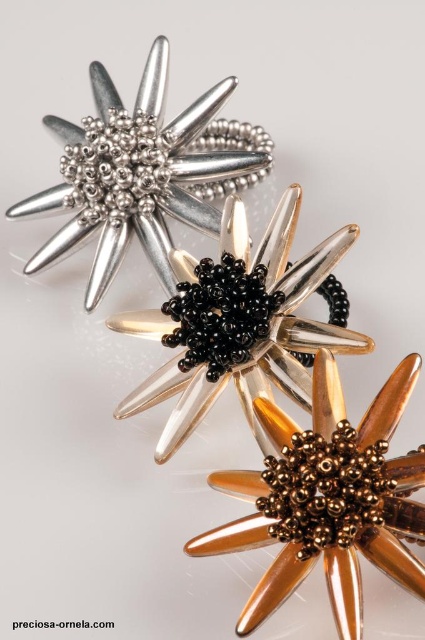
Question: Which of the following is the closest to the observer?

Choices:
 (A) (278, 352)
 (B) (419, 465)
 (C) (158, 72)

Answer: (B)

Question: Among these points, which one is farthest from the camera?

Choices:
 (A) (257, 397)
 (B) (70, 150)

Answer: (B)

Question: Can you confirm if gold metallic flower at center is positioned above matte silver flower at upper left?

Choices:
 (A) no
 (B) yes

Answer: (A)

Question: Which object is the closest to the gold metallic flower at center?

Choices:
 (A) black beaded flower at center
 (B) matte silver flower at upper left

Answer: (A)

Question: Observing the image, what is the correct spatial positioning of black beaded flower at center in reference to matte silver flower at upper left?

Choices:
 (A) below
 (B) above

Answer: (A)

Question: Can you confirm if black beaded flower at center is thinner than gold metallic flower at center?

Choices:
 (A) no
 (B) yes

Answer: (A)